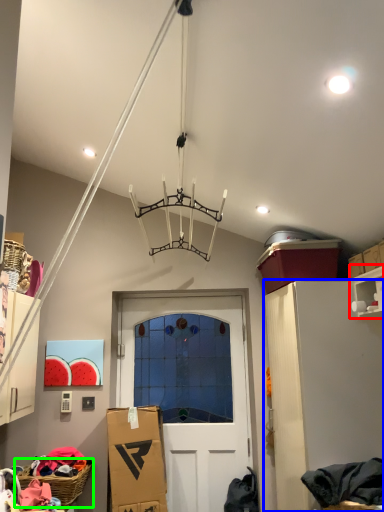
Question: Which object is the closest to the shelf (highlighted by a red box)? Choose among these: cabinetry (highlighted by a blue box) or basket (highlighted by a green box).

Choices:
 (A) cabinetry
 (B) basket

Answer: (A)